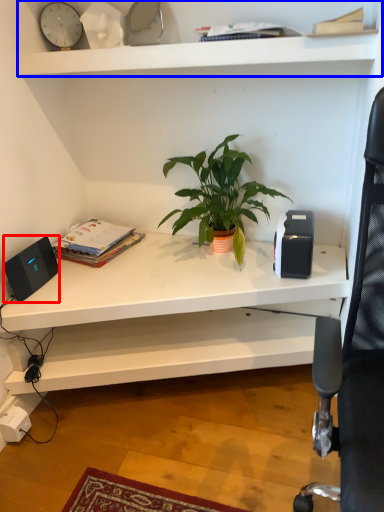
Question: Among these objects, which one is nearest to the camera, speaker (highlighted by a red box) or shelf (highlighted by a blue box)?

Choices:
 (A) speaker
 (B) shelf

Answer: (B)